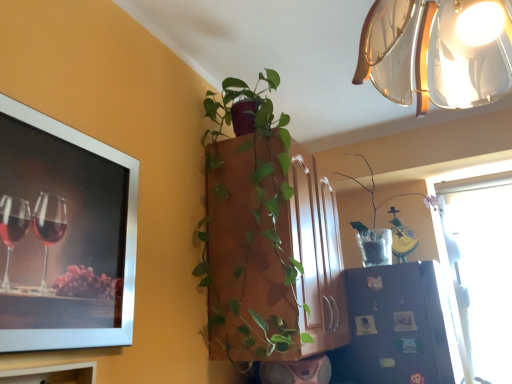
Question: Is green matte plant at center, positioned as the first houseplant in front-to-back order, facing away from silver metallic picture frame at upper left?

Choices:
 (A) no
 (B) yes

Answer: (A)

Question: Considering the relative positions of green matte plant at center, acting as the second houseplant starting from the right, and silver metallic picture frame at upper left in the image provided, is green matte plant at center, acting as the second houseplant starting from the right, behind silver metallic picture frame at upper left?

Choices:
 (A) yes
 (B) no

Answer: (A)

Question: Is green matte plant at center, acting as the second houseplant starting from the right, completely or partially outside of silver metallic picture frame at upper left?

Choices:
 (A) yes
 (B) no

Answer: (A)

Question: Is green matte plant at center, placed as the 2th houseplant when sorted from back to front, not near silver metallic picture frame at upper left?

Choices:
 (A) yes
 (B) no

Answer: (B)

Question: Does green matte plant at center, acting as the second houseplant starting from the right, have a larger size compared to silver metallic picture frame at upper left?

Choices:
 (A) no
 (B) yes

Answer: (B)

Question: Does point (236, 301) appear closer or farther from the camera than point (372, 190)?

Choices:
 (A) farther
 (B) closer

Answer: (B)

Question: From the image's perspective, is green matte plant at center, the 1th houseplant when ordered from left to right, above or below translucent glass vase at upper right, which appears as the second houseplant when viewed from the front?

Choices:
 (A) below
 (B) above

Answer: (B)

Question: From their relative heights in the image, would you say green matte plant at center, the 1th houseplant when ordered from left to right, is taller or shorter than translucent glass vase at upper right, which ranks as the first houseplant in right-to-left order?

Choices:
 (A) short
 (B) tall

Answer: (B)

Question: Is green matte plant at center, acting as the second houseplant starting from the right, to the left or to the right of translucent glass vase at upper right, which is counted as the second houseplant, starting from the left, in the image?

Choices:
 (A) left
 (B) right

Answer: (A)

Question: From a real-world perspective, is translucent glass lampshade at upper right physically located above or below silver metallic picture frame at upper left?

Choices:
 (A) above
 (B) below

Answer: (A)

Question: Would you say translucent glass lampshade at upper right is to the left or to the right of silver metallic picture frame at upper left in the picture?

Choices:
 (A) left
 (B) right

Answer: (B)

Question: From the image's perspective, is translucent glass lampshade at upper right positioned above or below silver metallic picture frame at upper left?

Choices:
 (A) above
 (B) below

Answer: (A)

Question: Choose the correct answer: Is translucent glass lampshade at upper right inside silver metallic picture frame at upper left or outside it?

Choices:
 (A) inside
 (B) outside

Answer: (B)

Question: Is point (425, 367) positioned closer to the camera than point (473, 11)?

Choices:
 (A) closer
 (B) farther

Answer: (B)

Question: In terms of height, does black matte refrigerator at lower right look taller or shorter compared to translucent glass lampshade at upper right?

Choices:
 (A) tall
 (B) short

Answer: (A)